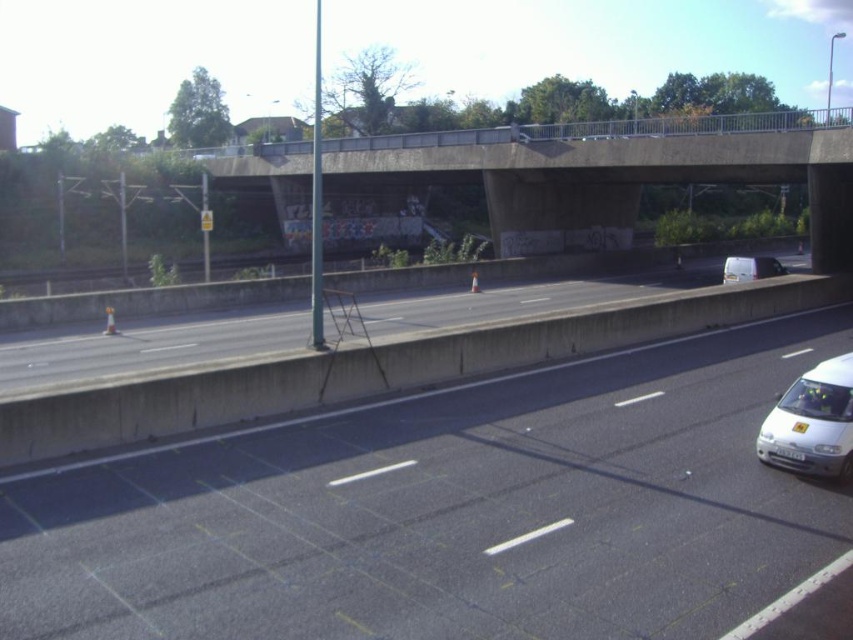
You are driving a truck that requires a route with a clear height clearance of 4.5 meters. You observe the black asphalt highway at center and the gray concrete highway at center in the scene. Which highway should you choose to ensure safe passage?

The black asphalt highway at center is positioned under the gray concrete highway at center, so the black asphalt highway at center likely has sufficient height clearance for the truck. Choose the black asphalt highway at center.

A drone is flying at a height of 35 feet above the ground. It wants to capture a photo of the point at coordinates point (294, 445). Will the drone be able to take the photo without crashing into the overpass?

The drone is flying at 35 feet, and the distance between the drone and the point (294, 445) is 36.46 feet. Since the drone is below the overpass, it can safely capture the photo without crashing.